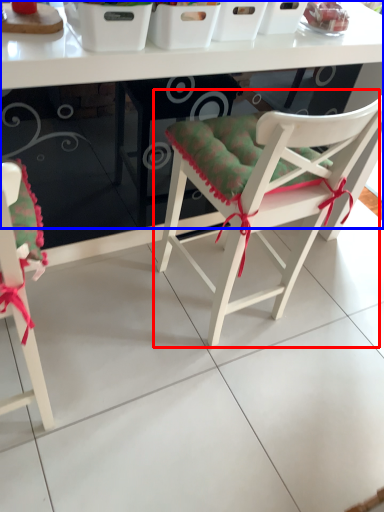
Question: Among these objects, which one is nearest to the camera, chair (highlighted by a red box) or table (highlighted by a blue box)?

Choices:
 (A) chair
 (B) table

Answer: (A)